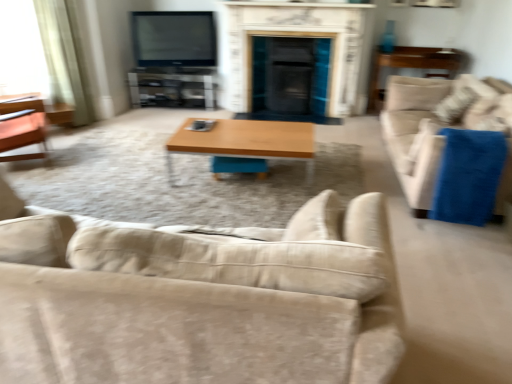
Describe the element at coordinates (438, 131) in the screenshot. Image resolution: width=512 pixels, height=384 pixels. I see `beige fabric couch at right, placed as the second studio couch when sorted from front to back` at that location.

What is the approximate width of wooden side table at right?

The width of wooden side table at right is 21.28 inches.

This screenshot has height=384, width=512. I want to click on clear glass entertainment center at center, so pyautogui.click(x=173, y=87).

The width and height of the screenshot is (512, 384). What are the coordinates of `matte black tv at upper center` in the screenshot? It's located at (174, 38).

Describe the element at coordinates (199, 299) in the screenshot. Image resolution: width=512 pixels, height=384 pixels. I see `beige fabric couch at lower center, the second studio couch in the right-to-left sequence` at that location.

This screenshot has width=512, height=384. What are the coordinates of `beige fabric couch at right, which is the 2th studio couch in left-to-right order` in the screenshot? It's located at (438, 131).

From the image's perspective, which one is positioned lower, matte black tv at upper center or beige fabric couch at lower center, which appears as the first studio couch when viewed from the left?

beige fabric couch at lower center, which appears as the first studio couch when viewed from the left, from the image's perspective.

Which is more to the right, matte black tv at upper center or beige fabric couch at lower center, the 1th studio couch when ordered from front to back?

beige fabric couch at lower center, the 1th studio couch when ordered from front to back, is more to the right.

Can you confirm if matte black tv at upper center is thinner than beige fabric couch at lower center, the second studio couch in the right-to-left sequence?

Correct, the width of matte black tv at upper center is less than that of beige fabric couch at lower center, the second studio couch in the right-to-left sequence.

Does light beige fabric curtain at left appear on the right side of clear glass entertainment center at center?

No.

From the image's perspective, is light beige fabric curtain at left located beneath clear glass entertainment center at center?

Correct, light beige fabric curtain at left appears lower than clear glass entertainment center at center in the image.

From a real-world perspective, does light beige fabric curtain at left sit lower than clear glass entertainment center at center?

Incorrect, from a real-world perspective, light beige fabric curtain at left is higher than clear glass entertainment center at center.

The height and width of the screenshot is (384, 512). I want to click on curtain that appears below the clear glass entertainment center at center (from the image's perspective), so click(62, 59).

From a real-world perspective, which is physically above, beige fabric couch at lower center, the 1th studio couch when ordered from front to back, or beige fabric couch at right, which is the 1th studio couch in back-to-front order?

beige fabric couch at lower center, the 1th studio couch when ordered from front to back, is physically above.

From the image's perspective, is beige fabric couch at lower center, the 1th studio couch when ordered from front to back, located beneath beige fabric couch at right, which is counted as the first studio couch, starting from the right?

Correct, beige fabric couch at lower center, the 1th studio couch when ordered from front to back, appears lower than beige fabric couch at right, which is counted as the first studio couch, starting from the right, in the image.

Considering the sizes of objects beige fabric couch at lower center, the 1th studio couch when ordered from front to back, and beige fabric couch at right, which is the 2th studio couch in left-to-right order, in the image provided, who is smaller, beige fabric couch at lower center, the 1th studio couch when ordered from front to back, or beige fabric couch at right, which is the 2th studio couch in left-to-right order,?

Smaller between the two is beige fabric couch at right, which is the 2th studio couch in left-to-right order.

Which of these two, beige fabric couch at lower center, which appears as the first studio couch when viewed from the left, or beige fabric couch at right, placed as the second studio couch when sorted from front to back, stands shorter?

Standing shorter between the two is beige fabric couch at right, placed as the second studio couch when sorted from front to back.

Can we say wooden/matte coffee table at center lies outside white marble fireplace at center?

Indeed, wooden/matte coffee table at center is completely outside white marble fireplace at center.

Considering the sizes of wooden/matte coffee table at center and white marble fireplace at center in the image, is wooden/matte coffee table at center taller or shorter than white marble fireplace at center?

Considering their sizes, wooden/matte coffee table at center has less height than white marble fireplace at center.

How many degrees apart are the facing directions of wooden/matte coffee table at center and white marble fireplace at center?

2.92 degrees separate the facing orientations of wooden/matte coffee table at center and white marble fireplace at center.

Considering the relative sizes of wooden/matte coffee table at center and white marble fireplace at center in the image provided, is wooden/matte coffee table at center thinner than white marble fireplace at center?

Yes, wooden/matte coffee table at center is thinner than white marble fireplace at center.

The image size is (512, 384). I want to click on entertainment center behind the light beige fabric curtain at left, so click(173, 87).

Who is taller, clear glass entertainment center at center or light beige fabric curtain at left?

With more height is light beige fabric curtain at left.

Considering the positions of objects clear glass entertainment center at center and light beige fabric curtain at left in the image provided, who is more to the right, clear glass entertainment center at center or light beige fabric curtain at left?

clear glass entertainment center at center is more to the right.

Is clear glass entertainment center at center not near light beige fabric curtain at left?

clear glass entertainment center at center is far away from light beige fabric curtain at left.

Are light beige fabric curtain at left and beige fabric couch at lower center, the second studio couch in the right-to-left sequence, making contact?

No, light beige fabric curtain at left is not making contact with beige fabric couch at lower center, the second studio couch in the right-to-left sequence.

Consider the image. Considering the sizes of objects light beige fabric curtain at left and beige fabric couch at lower center, which appears as the first studio couch when viewed from the left, in the image provided, who is bigger, light beige fabric curtain at left or beige fabric couch at lower center, which appears as the first studio couch when viewed from the left,?

With larger size is beige fabric couch at lower center, which appears as the first studio couch when viewed from the left.

Considering the sizes of objects light beige fabric curtain at left and beige fabric couch at lower center, which is counted as the second studio couch, starting from the back, in the image provided, who is thinner, light beige fabric curtain at left or beige fabric couch at lower center, which is counted as the second studio couch, starting from the back,?

Thinner between the two is light beige fabric curtain at left.

Considering the positions of objects light beige fabric curtain at left and beige fabric couch at lower center, which is counted as the second studio couch, starting from the back, in the image provided, who is more to the left, light beige fabric curtain at left or beige fabric couch at lower center, which is counted as the second studio couch, starting from the back,?

light beige fabric curtain at left is more to the left.

Can you confirm if wooden side table at right is wider than wooden/matte coffee table at center?

No.

Is wooden side table at right taller or shorter than wooden/matte coffee table at center?

In the image, wooden side table at right appears to be taller than wooden/matte coffee table at center.

Considering the positions of points (376, 59) and (271, 135), is point (376, 59) farther from camera compared to point (271, 135)?

Yes, point (376, 59) is behind point (271, 135).

Is wooden side table at right not close to wooden/matte coffee table at center?

wooden side table at right is positioned a significant distance from wooden/matte coffee table at center.

In order to click on the 2nd studio couch in front of the matte black tv at upper center, counting from the anchor's position in this screenshot , I will do `click(199, 299)`.

At what (x,y) coordinates should I click in order to perform the action: click on curtain on the left of clear glass entertainment center at center. Please return your answer as a coordinate pair (x, y). Looking at the image, I should click on click(x=62, y=59).

Which object lies nearer to the anchor point clear glass entertainment center at center, white marble fireplace at center or beige fabric couch at right, which is the 2th studio couch in left-to-right order?

Based on the image, white marble fireplace at center appears to be nearer to clear glass entertainment center at center.

Based on their spatial positions, is beige fabric couch at right, which is counted as the first studio couch, starting from the right, or wooden side table at right further from matte black tv at upper center?

beige fabric couch at right, which is counted as the first studio couch, starting from the right, lies further to matte black tv at upper center than the other object.

Which object lies further to the anchor point beige fabric couch at lower center, which appears as the first studio couch when viewed from the left, wooden side table at right or matte black tv at upper center?

wooden side table at right.

Based on their spatial positions, is clear glass entertainment center at center or beige fabric couch at lower center, which is counted as the second studio couch, starting from the back, further from light beige fabric curtain at left?

Among the two, beige fabric couch at lower center, which is counted as the second studio couch, starting from the back, is located further to light beige fabric curtain at left.

Considering their positions, is beige fabric couch at right, which is the 1th studio couch in back-to-front order, positioned closer to wooden/matte coffee table at center than matte black tv at upper center?

beige fabric couch at right, which is the 1th studio couch in back-to-front order, lies closer to wooden/matte coffee table at center than the other object.

Estimate the real-world distances between objects in this image. Which object is closer to clear glass entertainment center at center, beige fabric couch at lower center, the second studio couch in the right-to-left sequence, or matte black tv at upper center?

matte black tv at upper center lies closer to clear glass entertainment center at center than the other object.

Which object lies nearer to the anchor point light beige fabric curtain at left, wooden side table at right or beige fabric couch at right, which is counted as the first studio couch, starting from the right?

beige fabric couch at right, which is counted as the first studio couch, starting from the right, is closer to light beige fabric curtain at left.

Which object lies further to the anchor point matte black tv at upper center, beige fabric couch at lower center, which appears as the first studio couch when viewed from the left, or wooden side table at right?

Among the two, beige fabric couch at lower center, which appears as the first studio couch when viewed from the left, is located further to matte black tv at upper center.

Find the location of a particular element. The width and height of the screenshot is (512, 384). curtain between beige fabric couch at lower center, which is counted as the second studio couch, starting from the back, and white marble fireplace at center from front to back is located at coordinates (62, 59).

You are a GUI agent. You are given a task and a screenshot of the screen. Output one action in this format:
    pyautogui.click(x=<x>, y=<y>)
    Task: Click on the studio couch positioned between beige fabric couch at lower center, which appears as the first studio couch when viewed from the left, and clear glass entertainment center at center from near to far
    
    Given the screenshot: What is the action you would take?
    pyautogui.click(x=438, y=131)

Where is `television between light beige fabric curtain at left and white marble fireplace at center in the horizontal direction`? This screenshot has width=512, height=384. television between light beige fabric curtain at left and white marble fireplace at center in the horizontal direction is located at coordinates (174, 38).

Where is `coffee table situated between light beige fabric curtain at left and white marble fireplace at center from left to right`? The width and height of the screenshot is (512, 384). coffee table situated between light beige fabric curtain at left and white marble fireplace at center from left to right is located at coordinates (245, 142).